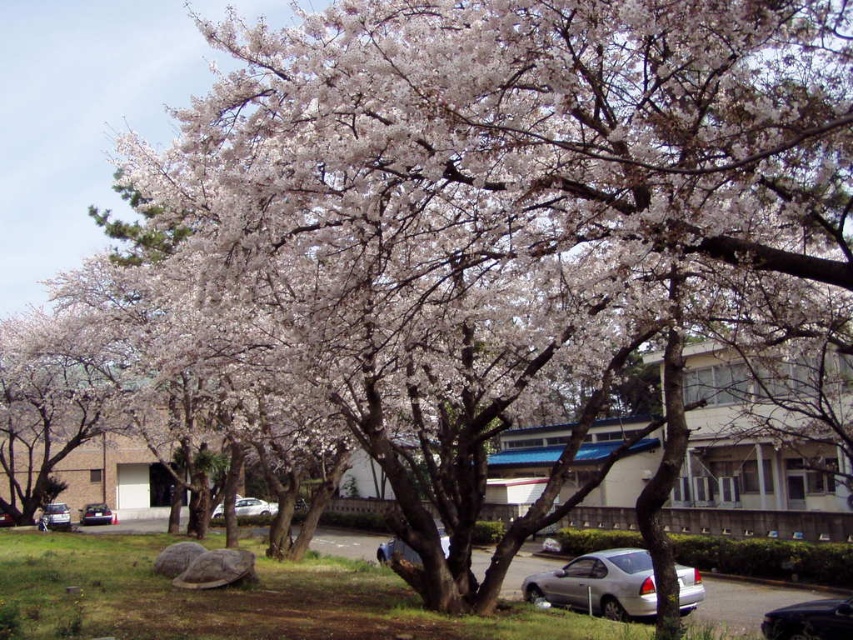
Question: Can you confirm if white matte flower at upper center is positioned above silver metallic car at lower center?

Choices:
 (A) yes
 (B) no

Answer: (A)

Question: From the image, what is the correct spatial relationship of white matte flower at upper center in relation to silver metallic car at lower center?

Choices:
 (A) below
 (B) above

Answer: (B)

Question: Estimate the real-world distances between objects in this image. Which object is farther from the silver metallic sedan at lower left?

Choices:
 (A) white matte flower at upper center
 (B) silver metallic car at center
 (C) metallic silver sedan at center

Answer: (A)

Question: Can you confirm if white matte flower at upper center is thinner than silver metallic car at center?

Choices:
 (A) yes
 (B) no

Answer: (B)

Question: Which object appears farthest from the camera in this image?

Choices:
 (A) silver metallic sedan at lower left
 (B) white matte flower at upper center
 (C) silver metallic car at lower center

Answer: (B)

Question: Which point is closer to the camera?

Choices:
 (A) (49, 509)
 (B) (821, 637)
 (C) (221, 513)
 (D) (590, 560)

Answer: (B)